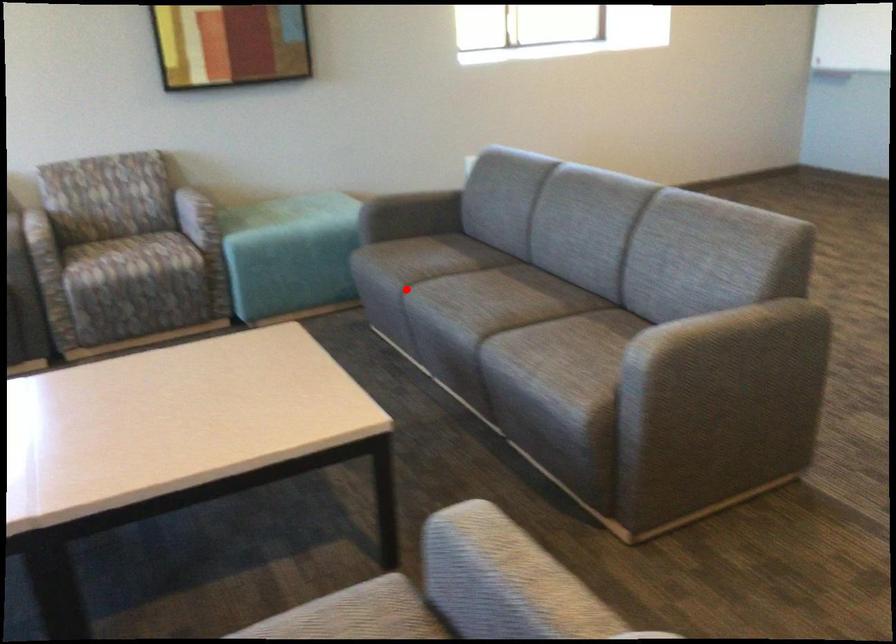
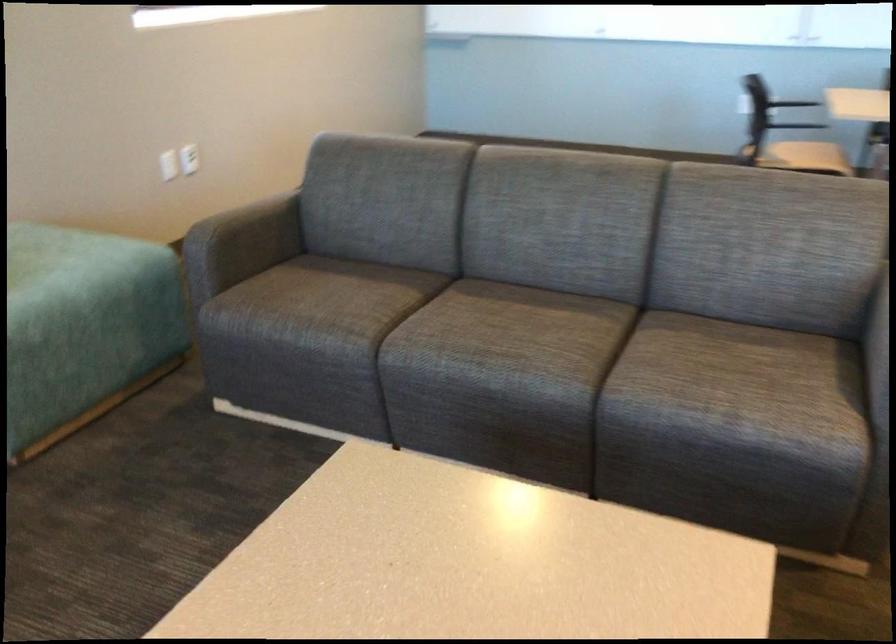
Question: I am providing you with two images of the same scene from different viewpoints. A red point is shown in image1. For the corresponding object point in image2, is it positioned nearer or farther from the camera?

Choices:
 (A) Nearer
 (B) Farther

Answer: (A)